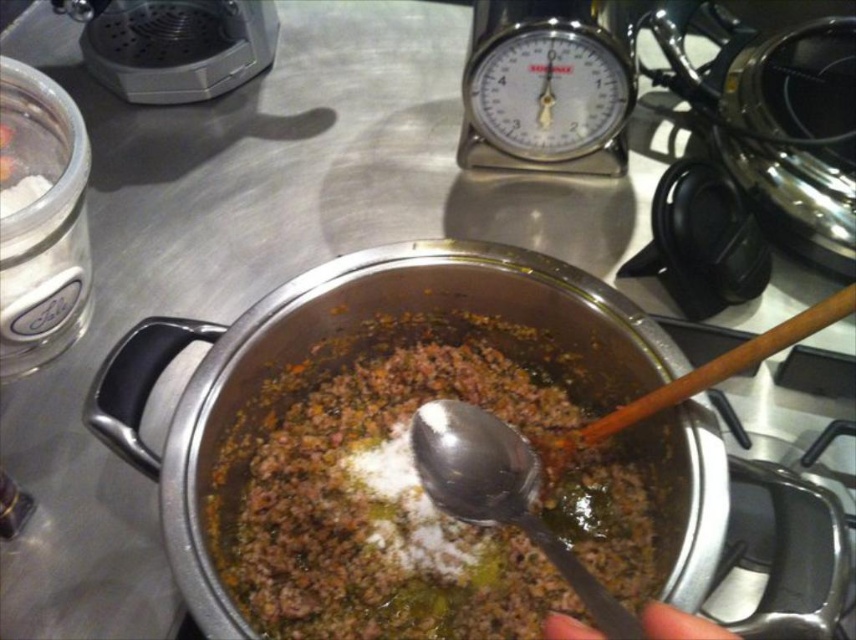
You are standing at the point with coordinates point (336, 550) and want to reach the point (434, 440). Which direction should you move in to get there?

Since point (336, 550) is behind point (434, 440), you should move forward to reach it.

You are a chef preparing a dish and need to check if the brown matte ground meat at center is placed above the silver metallic spoon at center. Can you confirm this?

The brown matte ground meat at center is positioned over the silver metallic spoon at center, so yes, the brown matte ground meat at center is indeed placed above the silver metallic spoon at center.